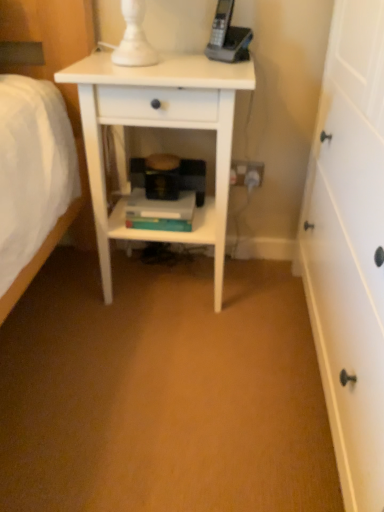
The height and width of the screenshot is (512, 384). What are the coordinates of `vacant point to the right of white matte nightstand at center` in the screenshot? It's located at (269, 300).